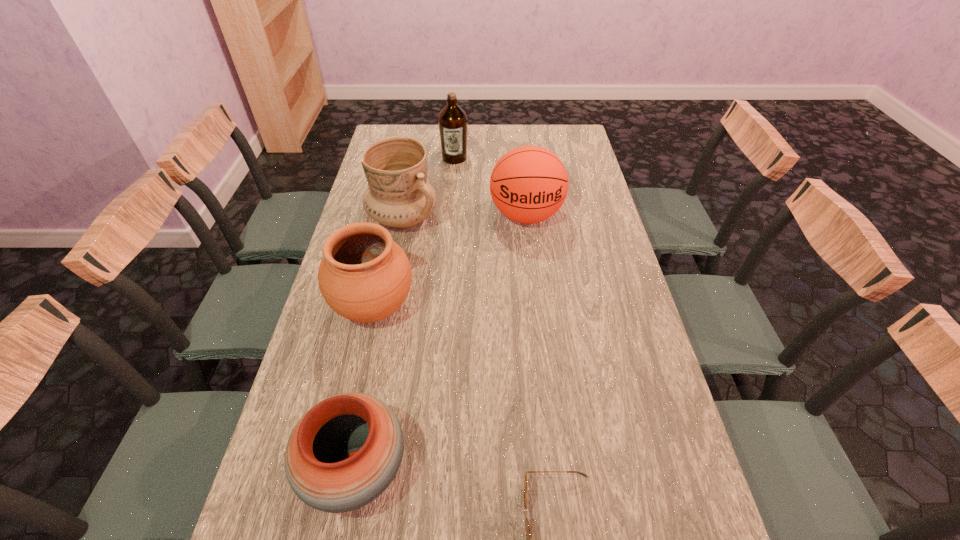
Image resolution: width=960 pixels, height=540 pixels. I want to click on free spot between the farthest pottery and the nearest pottery, so click(379, 344).

I want to click on free space between the farthest pottery and the shortest pottery, so click(379, 344).

Where is `free space between the third nearest object and the basketball`? The width and height of the screenshot is (960, 540). free space between the third nearest object and the basketball is located at coordinates (450, 262).

Point out which object is positioned as the third nearest to the shortest object. Please provide its 2D coordinates. Your answer should be formatted as a tuple, i.e. [(x, y)], where the tuple contains the x and y coordinates of a point satisfying the conditions above.

[(529, 184)]

Point out which object is positioned as the fourth nearest to the fifth tallest object. Please provide its 2D coordinates. Your answer should be formatted as a tuple, i.e. [(x, y)], where the tuple contains the x and y coordinates of a point satisfying the conditions above.

[(529, 184)]

Where is `the third closest pottery to the sunglasses`? the third closest pottery to the sunglasses is located at coordinates (399, 196).

Locate an element on the screen. Image resolution: width=960 pixels, height=540 pixels. the third closest pottery relative to the basketball is located at coordinates (344, 452).

Locate an element on the screen. This screenshot has height=540, width=960. vacant area in the image that satisfies the following two spatial constraints: 1. on the front side of the nearest pottery; 2. on the left side of the farthest pottery is located at coordinates (354, 469).